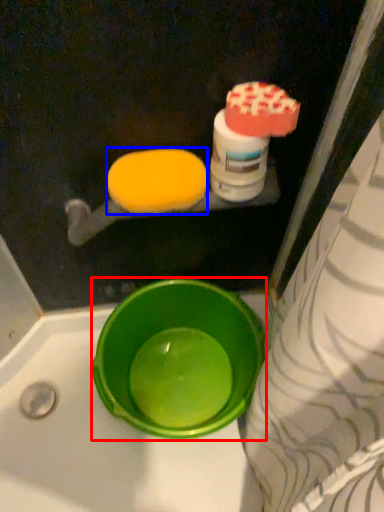
Question: Which point is closer to the camera, basin (highlighted by a red box) or food (highlighted by a blue box)?

Choices:
 (A) basin
 (B) food

Answer: (B)